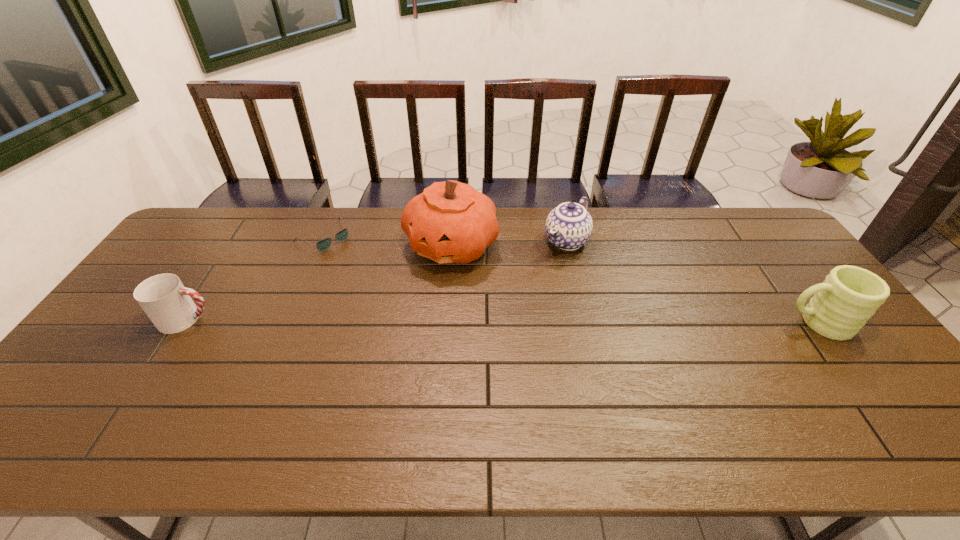
Locate an element on the screen. Image resolution: width=960 pixels, height=540 pixels. free space between the second object from left to right and the tallest object is located at coordinates (388, 241).

Identify the location of unoccupied position between the sunglasses and the tallest object. (388, 241).

Identify the location of free point between the mug and the cup. This screenshot has height=540, width=960. (502, 321).

Where is `vacant area that lies between the third object from left to right and the second shortest object`? The width and height of the screenshot is (960, 540). vacant area that lies between the third object from left to right and the second shortest object is located at coordinates (319, 282).

What are the coordinates of `free space between the third object from left to right and the shortest object` in the screenshot? It's located at (388, 241).

You are a GUI agent. You are given a task and a screenshot of the screen. Output one action in this format:
    pyautogui.click(x=<x>, y=<y>)
    Task: Click on the free space between the chinaware and the pumpkin
    
    Given the screenshot: What is the action you would take?
    pyautogui.click(x=509, y=243)

Where is `vacant space that's between the pumpkin and the mug`? The height and width of the screenshot is (540, 960). vacant space that's between the pumpkin and the mug is located at coordinates (635, 284).

Locate an element on the screen. This screenshot has width=960, height=540. unoccupied position between the sunglasses and the rightmost object is located at coordinates (571, 280).

The height and width of the screenshot is (540, 960). What are the coordinates of `object that stands as the fourth closest to the shortest object` in the screenshot? It's located at (848, 297).

You are a GUI agent. You are given a task and a screenshot of the screen. Output one action in this format:
    pyautogui.click(x=<x>, y=<y>)
    Task: Click on the third closest object to the cup
    The height and width of the screenshot is (540, 960).
    Given the screenshot: What is the action you would take?
    pyautogui.click(x=569, y=226)